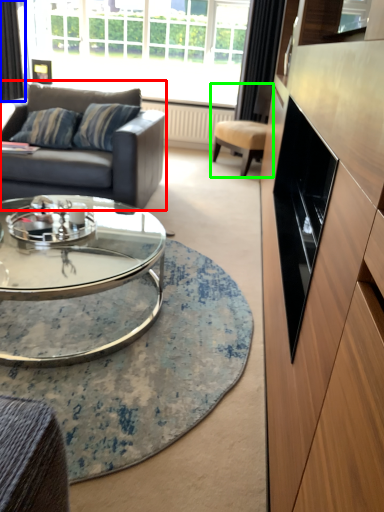
Question: Which object is positioned farthest from studio couch (highlighted by a red box)? Select from curtain (highlighted by a blue box) and chair (highlighted by a green box).

Choices:
 (A) curtain
 (B) chair

Answer: (A)